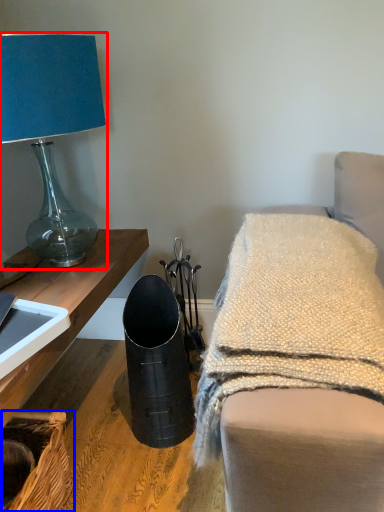
Question: Which point is further to the camera, lamp (highlighted by a red box) or basket (highlighted by a blue box)?

Choices:
 (A) lamp
 (B) basket

Answer: (A)